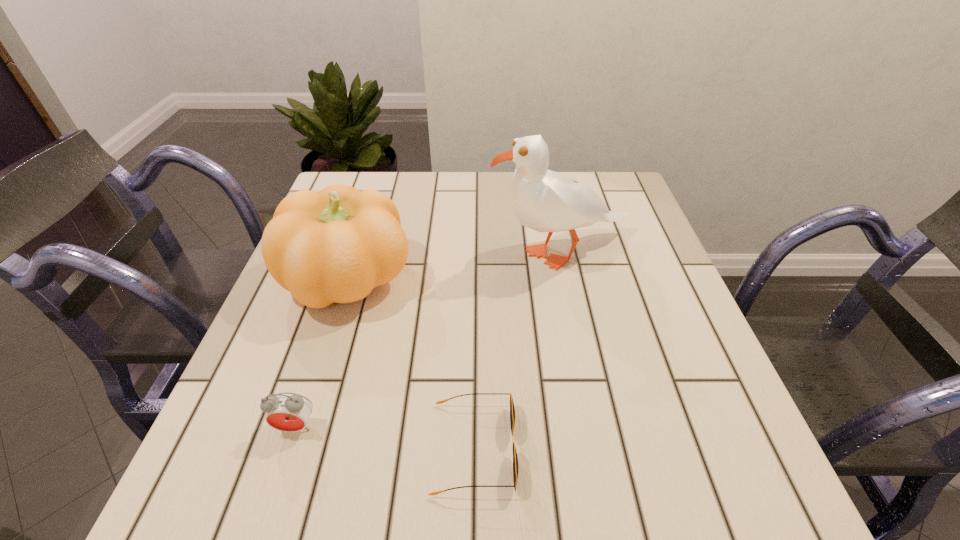
At what (x,y) coordinates should I click in order to perform the action: click on the tallest object. Please return your answer as a coordinate pair (x, y). The height and width of the screenshot is (540, 960). Looking at the image, I should click on (543, 200).

Locate an element on the screen. the second tallest object is located at coordinates (336, 245).

In order to click on alarm clock in this screenshot , I will do `click(289, 412)`.

Find the location of a particular element. the shortest object is located at coordinates (512, 409).

This screenshot has width=960, height=540. I want to click on vacant space located 0.370m at the beak of the tallest object, so click(333, 254).

Locate an element on the screen. This screenshot has height=540, width=960. vacant point located at the beak of the tallest object is located at coordinates (400, 254).

Where is `free region located 0.050m at the beak of the tallest object`? free region located 0.050m at the beak of the tallest object is located at coordinates (468, 254).

Identify the location of vacant space positioned 0.170m on the front of the pumpkin. (311, 404).

This screenshot has height=540, width=960. I want to click on vacant space located 0.120m on the front-facing side of the sunglasses, so click(x=591, y=448).

Locate an element on the screen. object at the near edge is located at coordinates (512, 409).